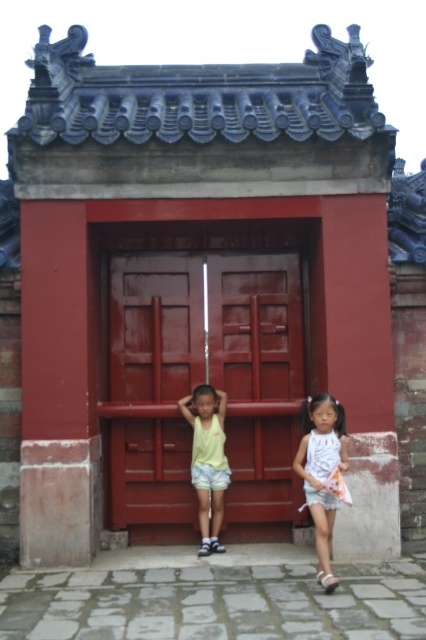
Question: Is white cotton dress at center closer to the viewer compared to yellow fabric shirt at center?

Choices:
 (A) yes
 (B) no

Answer: (A)

Question: Can you confirm if white cotton dress at center is smaller than yellow fabric shirt at center?

Choices:
 (A) no
 (B) yes

Answer: (A)

Question: Among these objects, which one is nearest to the camera?

Choices:
 (A) white cotton dress at center
 (B) yellow fabric shirt at center
 (C) matte wood door at center

Answer: (A)

Question: Which object appears closest to the camera in this image?

Choices:
 (A) white cotton dress at center
 (B) yellow fabric shirt at center

Answer: (A)

Question: Is white cotton dress at center behind yellow fabric shirt at center?

Choices:
 (A) no
 (B) yes

Answer: (A)

Question: Which point is farther to the camera?

Choices:
 (A) (305, 472)
 (B) (207, 310)
 (C) (218, 426)

Answer: (B)